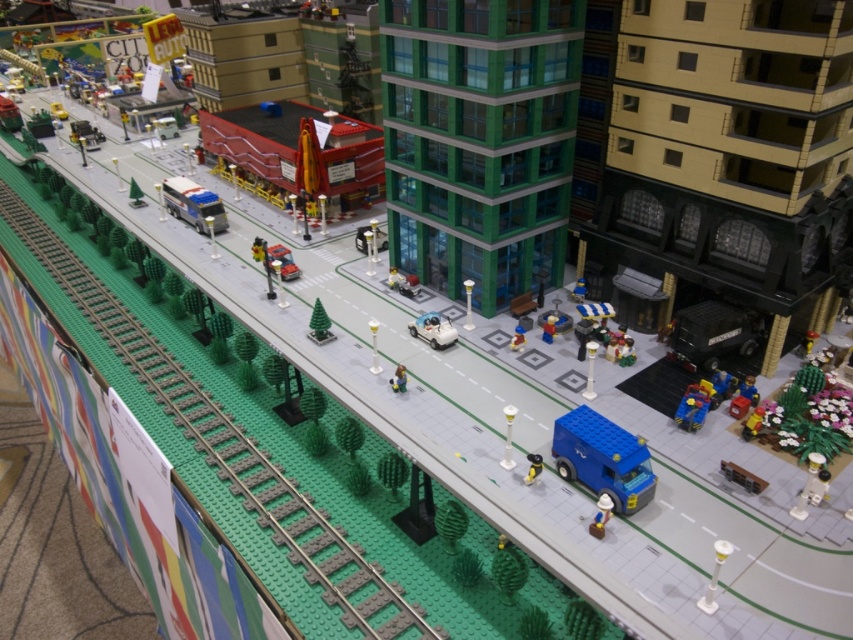
Question: Is blue plastic car at lower right wider than brown matte hat at lower center?

Choices:
 (A) no
 (B) yes

Answer: (B)

Question: Can you confirm if matte blue bus at center is smaller than shiny red car at center?

Choices:
 (A) yes
 (B) no

Answer: (B)

Question: Which point is farther to the camera?

Choices:
 (A) shiny yellow toy car at center
 (B) blue plastic figure at center-right
 (C) smooth gray figure at center
 (D) shiny red car at center

Answer: (D)

Question: Which is farther from the smooth red truck at center?

Choices:
 (A) shiny silver car at center
 (B) shiny yellow toy car at center
 (C) smooth gray figure at center

Answer: (B)

Question: Among these objects, which one is nearest to the camera?

Choices:
 (A) green matte tree at center
 (B) bright red plastic minifigure at center-right

Answer: (A)

Question: Is smooth red truck at center further to the viewer compared to shiny red car at center?

Choices:
 (A) yes
 (B) no

Answer: (A)